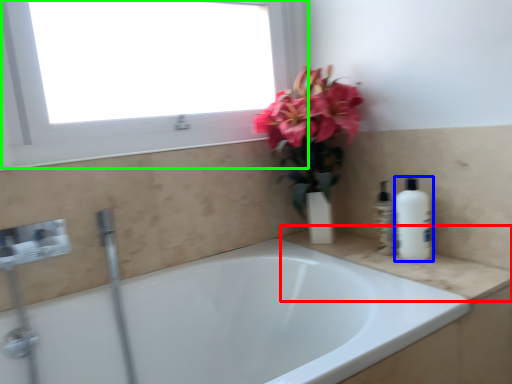
Question: Which object is the closest to the counter top (highlighted by a red box)? Choose among these: cleaning product (highlighted by a blue box) or window (highlighted by a green box).

Choices:
 (A) cleaning product
 (B) window

Answer: (A)